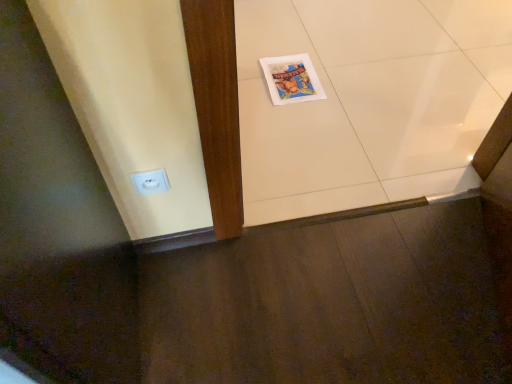
I want to click on free space on the front side of matte paper comic book at center, so click(x=301, y=119).